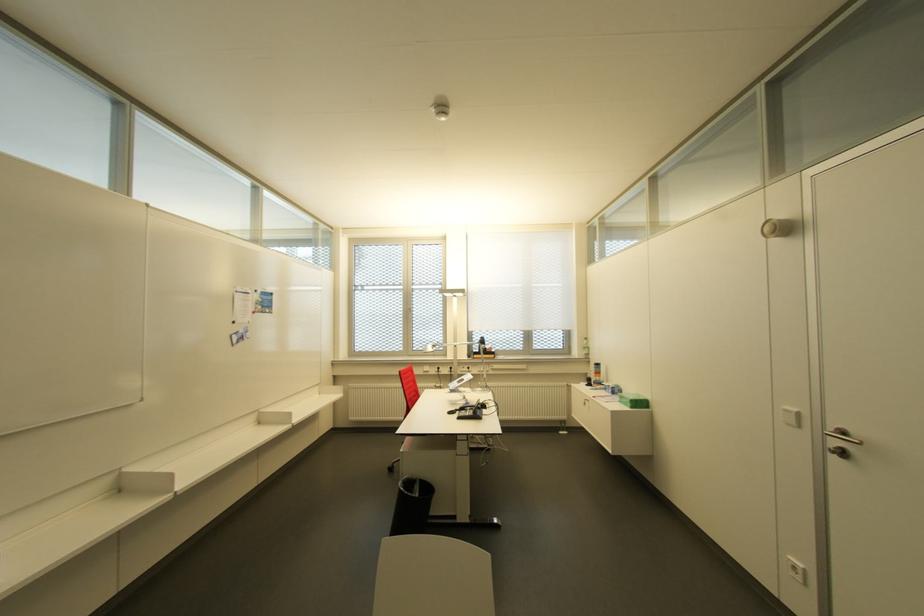
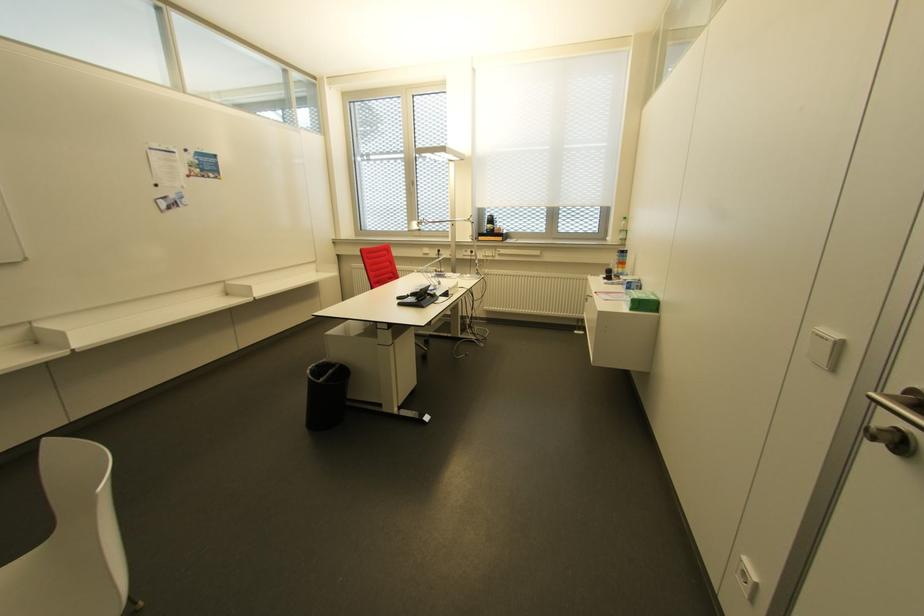
In the second image, find the point that corresponds to point 415,487 in the first image.

(329, 371)